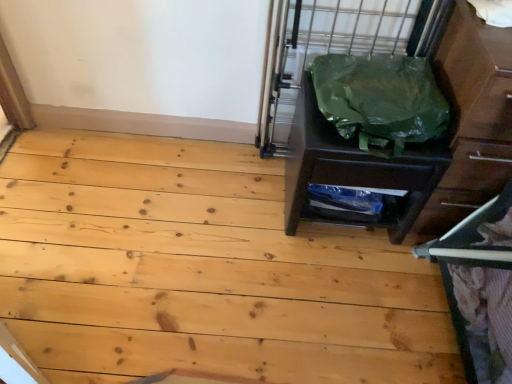
Image resolution: width=512 pixels, height=384 pixels. I want to click on free space above natural wood floor at center (from a real-world perspective), so click(x=237, y=254).